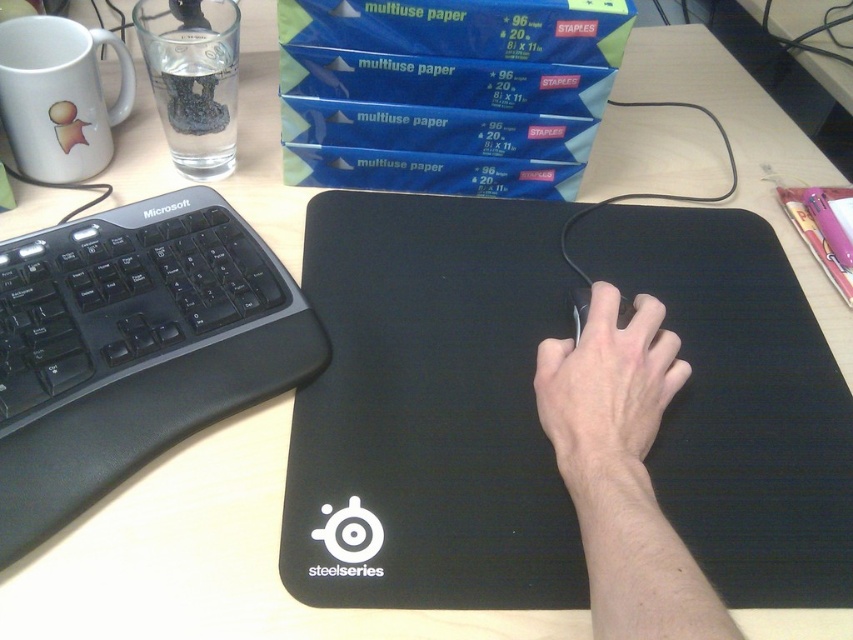
You are a delivery person who needs to place a new item on the desk. The desk has two specific points marked as point (610, 301) and point (572, 296). If you want to place the item closer to the foreground, which point should you choose?

Point (610, 301) is in front of point (572, 296), so placing the item at point (610, 301) would be closer to the foreground.

You are organizing the desk items and need to place a new item between the black matte keyboard at left and the matte black mouse at center. Is this possible given their positions?

The black matte keyboard at left is above the matte black mouse at center, so there is no space between them horizontally. You cannot place an item between them as they are vertically aligned.

You are setting up a new desk and want to ensure your mouse fits comfortably. You have two mice labeled as matte black mouse at center and black matte mouse at center. Which one has a larger width?

The matte black mouse at center has a larger width than the black matte mouse at center.